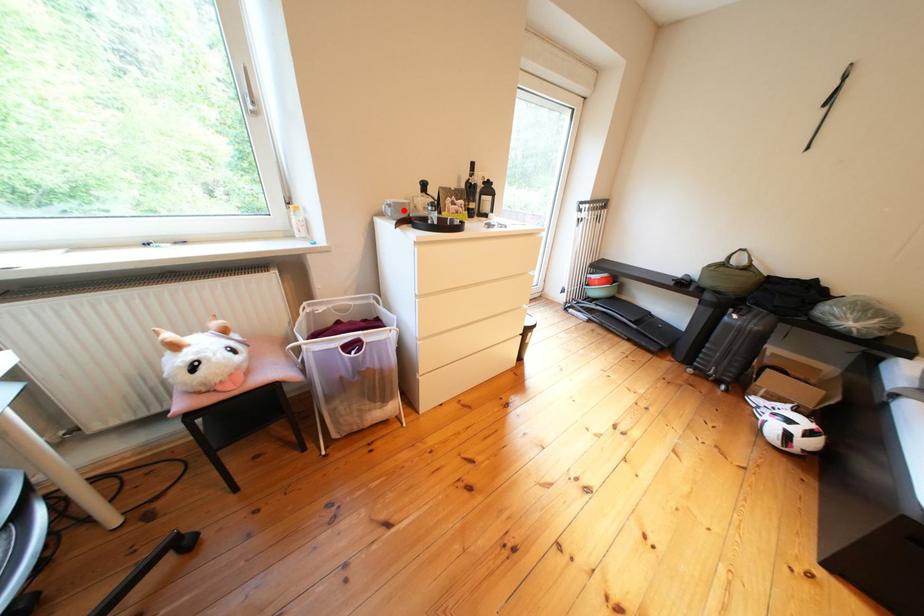
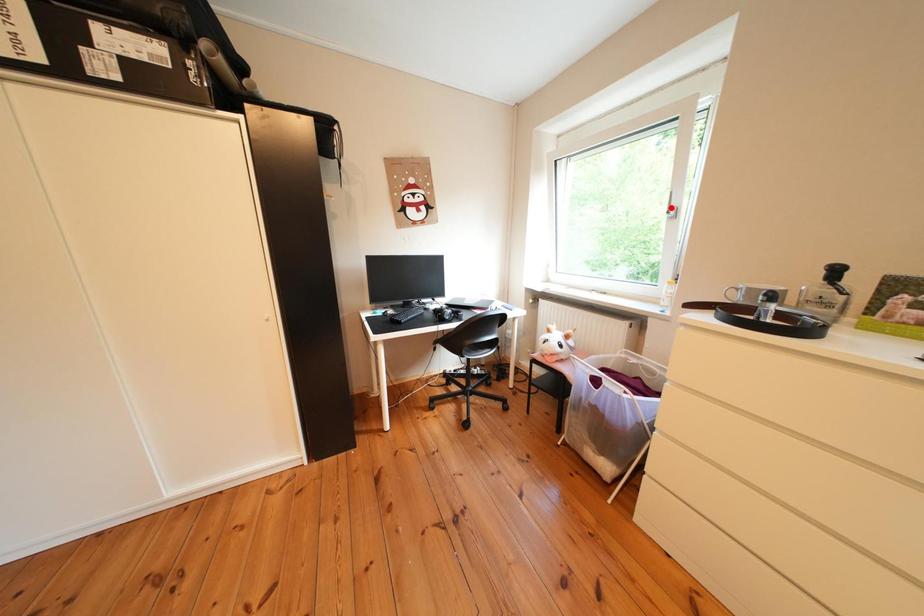
I am providing you with two images of the same scene from different viewpoints. A red point is marked on the first image and another point is marked on the second image. Is the marked point in image1 the same physical position as the marked point in image2?

No